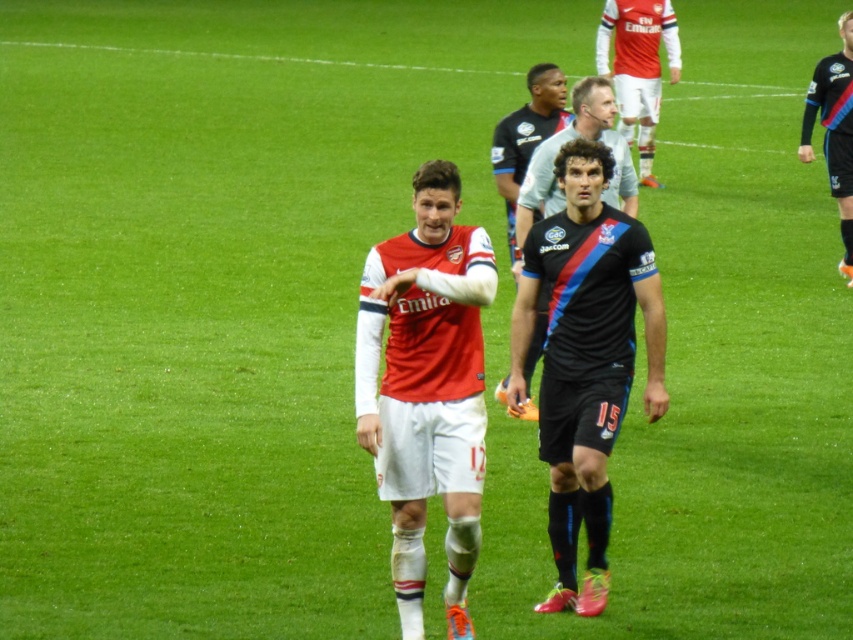
Does matte red jersey at center have a smaller size compared to matte jersey at upper center?

Yes, matte red jersey at center is smaller than matte jersey at upper center.

Is matte red jersey at center further to the viewer compared to matte jersey at upper center?

No, it is not.

Which is behind, point (399, 586) or point (650, 104)?

Positioned behind is point (650, 104).

The height and width of the screenshot is (640, 853). What are the coordinates of `matte red jersey at center` in the screenshot? It's located at (427, 388).

Can you confirm if black matte jersey at center is bigger than matte jersey at upper center?

No, black matte jersey at center is not bigger than matte jersey at upper center.

Looking at this image, between black matte jersey at center and matte jersey at upper center, which one has less height?

black matte jersey at center is shorter.

Between point (566, 296) and point (663, 26), which one is positioned in front?

Point (566, 296) is more forward.

The width and height of the screenshot is (853, 640). I want to click on black matte jersey at center, so click(585, 356).

Can you confirm if matte jersey at upper center is positioned below black jersey at center?

No, matte jersey at upper center is not below black jersey at center.

You are a GUI agent. You are given a task and a screenshot of the screen. Output one action in this format:
    pyautogui.click(x=<x>, y=<y>)
    Task: Click on the matte jersey at upper center
    
    Given the screenshot: What is the action you would take?
    pyautogui.click(x=637, y=67)

Where is `matte jersey at upper center`? The height and width of the screenshot is (640, 853). matte jersey at upper center is located at coordinates (637, 67).